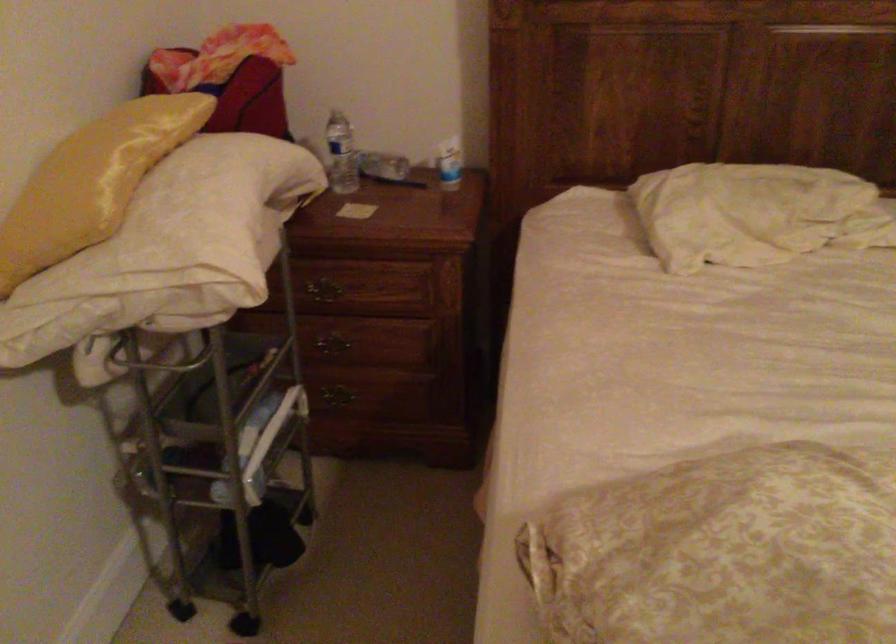
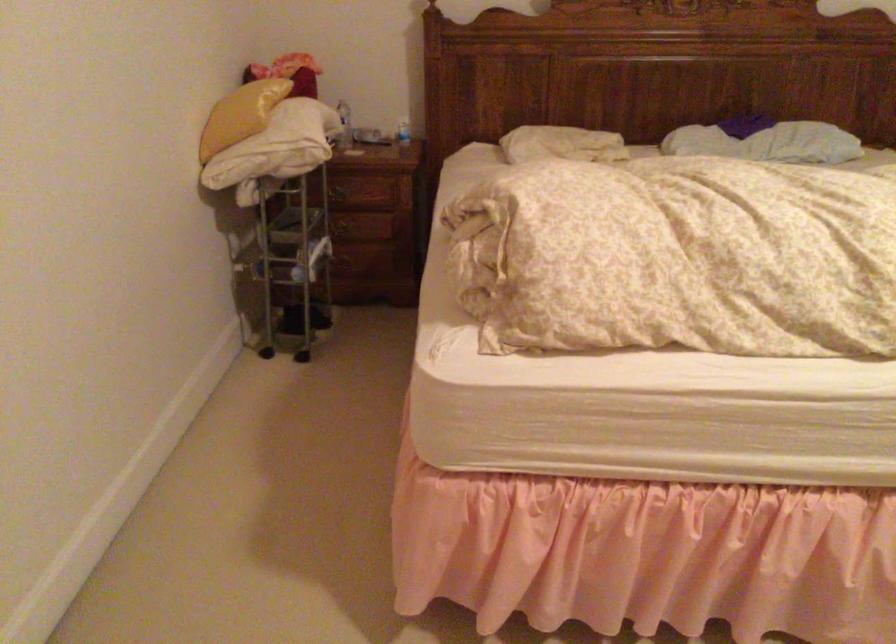
Where in the second image is the point corresponding to pixel 743 220 from the first image?

(561, 144)